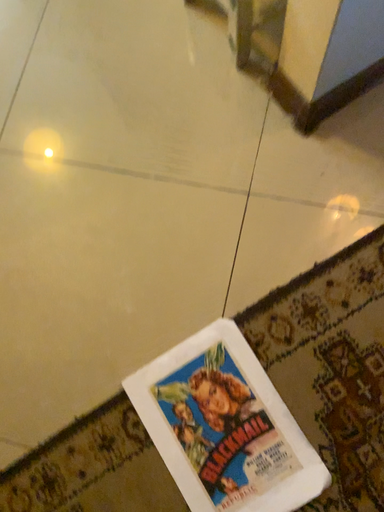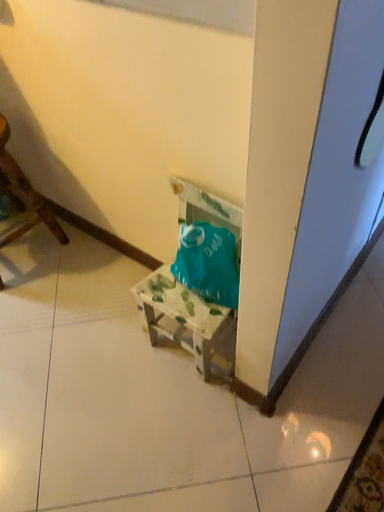
Question: Which way did the camera rotate in the video?

Choices:
 (A) rotated downward
 (B) rotated upward

Answer: (B)